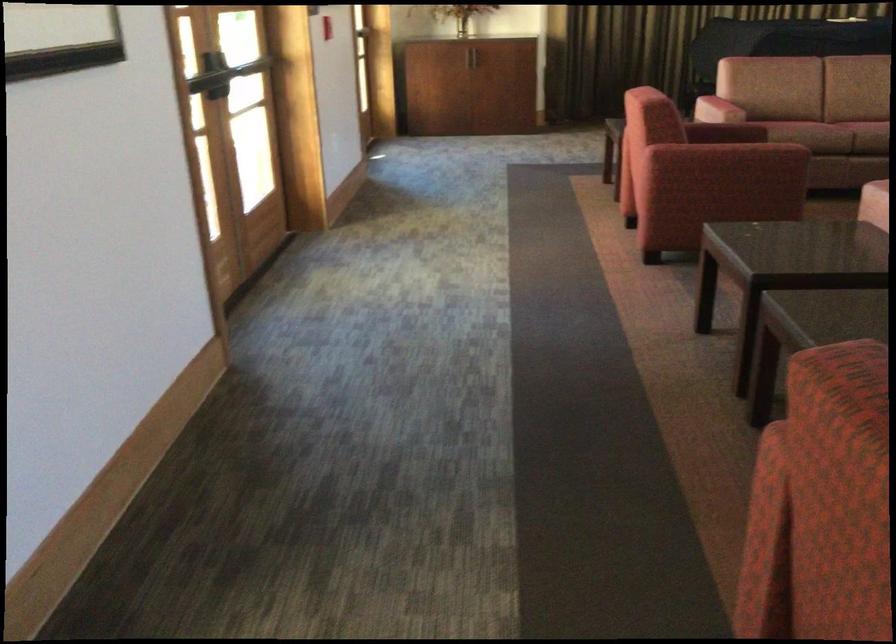
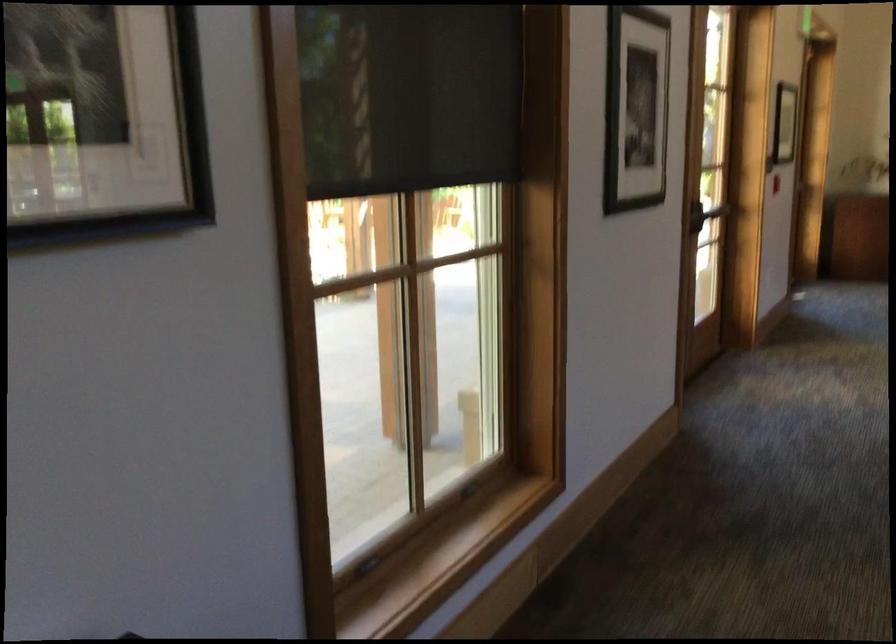
Question: In a continuous first-person perspective shot, in which direction is the camera moving?

Choices:
 (A) Left
 (B) Right
 (C) Forward
 (D) Backward

Answer: (D)